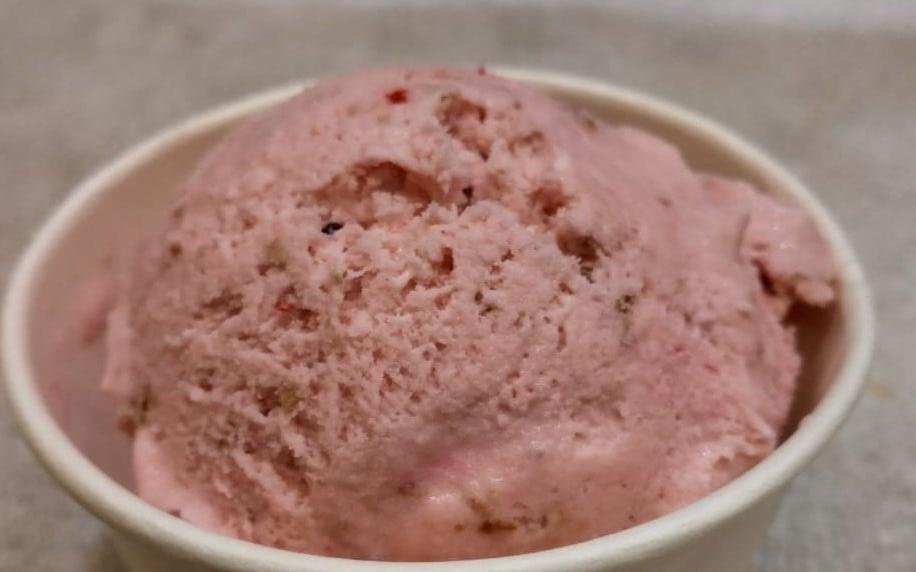
I want to click on far right edge of bowl, so click(x=873, y=313).